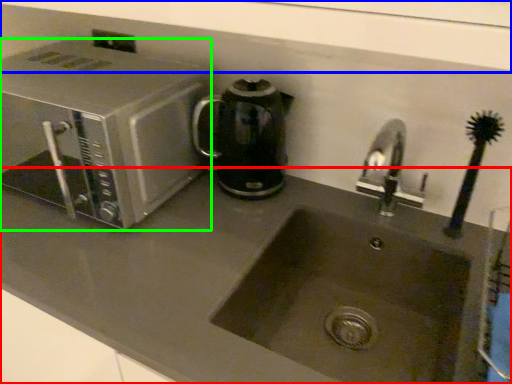
Question: Estimate the real-world distances between objects in this image. Which object is farther from counter top (highlighted by a red box), window sill (highlighted by a blue box) or microwave oven (highlighted by a green box)?

Choices:
 (A) window sill
 (B) microwave oven

Answer: (A)